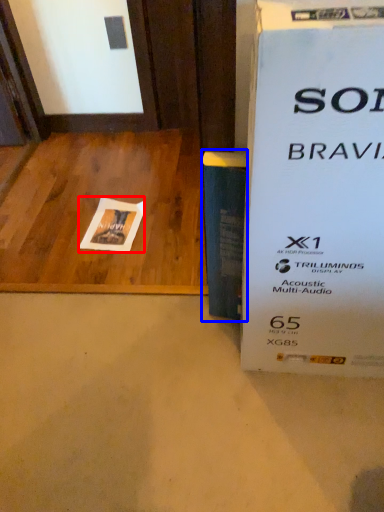
Question: Which object is closer to the camera taking this photo, flyer (highlighted by a red box) or paperback book (highlighted by a blue box)?

Choices:
 (A) flyer
 (B) paperback book

Answer: (B)